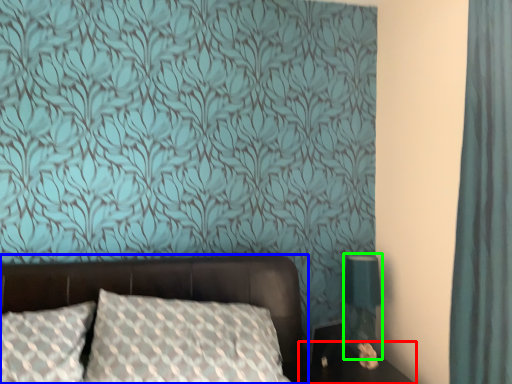
Question: Estimate the real-world distances between objects in this image. Which object is closer to table (highlighted by a red box), bed (highlighted by a blue box) or table lamp (highlighted by a green box)?

Choices:
 (A) bed
 (B) table lamp

Answer: (B)